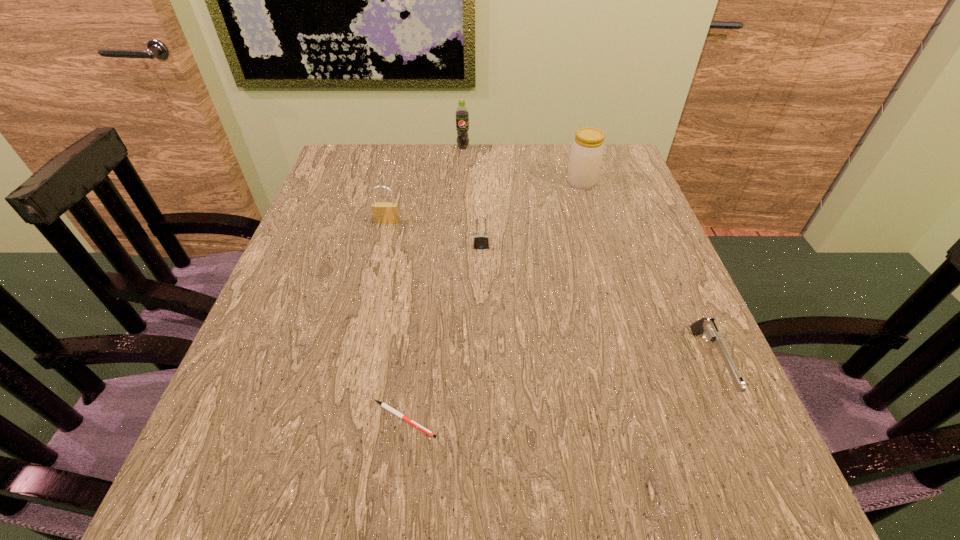
This screenshot has width=960, height=540. What are the coordinates of `vacant space in between the farther padlock and the soda` in the screenshot? It's located at (425, 185).

Where is `vacant region between the pistol and the shortest object`? vacant region between the pistol and the shortest object is located at coordinates (557, 392).

This screenshot has height=540, width=960. I want to click on vacant space that is in between the second shortest object and the taller padlock, so click(x=548, y=293).

You are a GUI agent. You are given a task and a screenshot of the screen. Output one action in this format:
    pyautogui.click(x=<x>, y=<y>)
    Task: Click on the free spot between the pistol and the fourth nearest object
    Image resolution: width=960 pixels, height=540 pixels.
    Given the screenshot: What is the action you would take?
    pyautogui.click(x=548, y=293)

The height and width of the screenshot is (540, 960). Find the location of `vacant region between the third nearest object and the fifth nearest object`. vacant region between the third nearest object and the fifth nearest object is located at coordinates (532, 214).

I want to click on empty location between the third shortest object and the pen, so click(443, 333).

Find the location of a particular element. This screenshot has width=960, height=540. object that is the third closest to the third farthest object is located at coordinates pos(587,150).

Choose which object is the nearest neighbor to the third object from right to left. Please provide its 2D coordinates. Your answer should be formatted as a tuple, i.e. [(x, y)], where the tuple contains the x and y coordinates of a point satisfying the conditions above.

[(383, 212)]

At what (x,y) coordinates should I click in order to perform the action: click on free space that satisfies the following two spatial constraints: 1. on the front-facing side of the fifth tallest object; 2. on the clicker of the pen. Please return your answer as a coordinate pair (x, y). This screenshot has width=960, height=540. Looking at the image, I should click on (732, 419).

At what (x,y) coordinates should I click in order to perform the action: click on blank space that satisfies the following two spatial constraints: 1. on the shackle of the third object from right to left; 2. on the clicker of the pen. Please return your answer as a coordinate pair (x, y). Looking at the image, I should click on (482, 419).